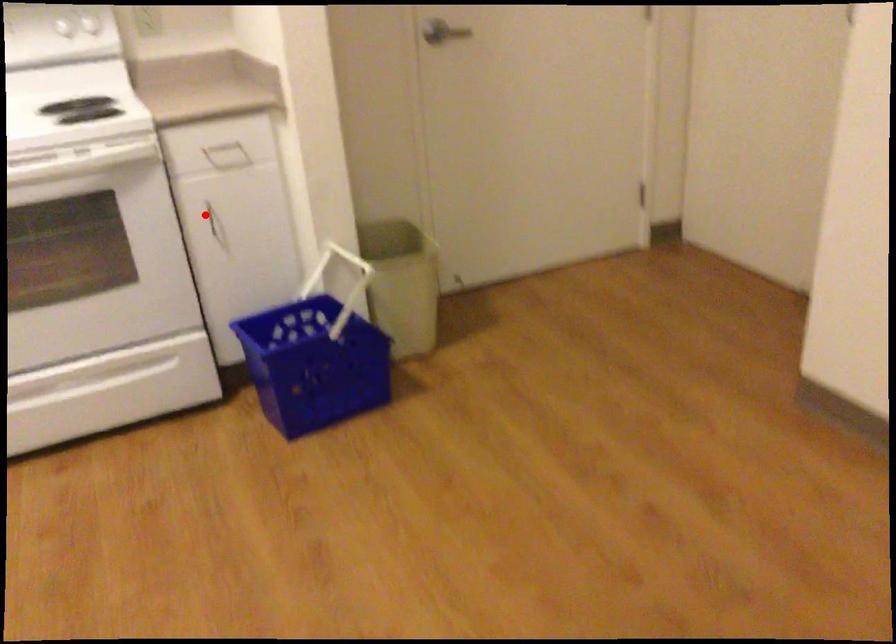
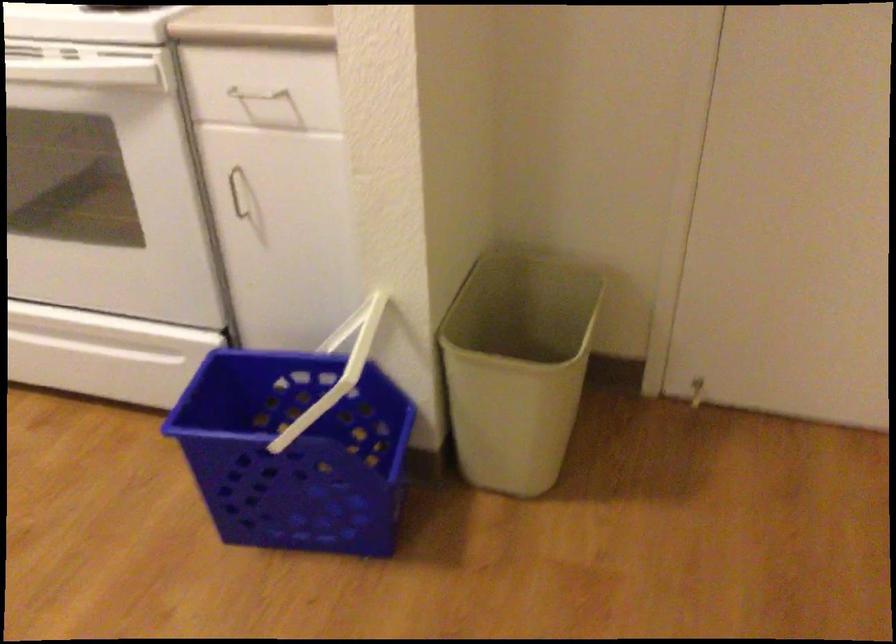
Question: I am providing you with two images of the same scene from different viewpoints. In image1, a red point is highlighted. Considering the same 3D point in image2, which of the following is correct?

Choices:
 (A) It is closer
 (B) It is farther

Answer: (A)